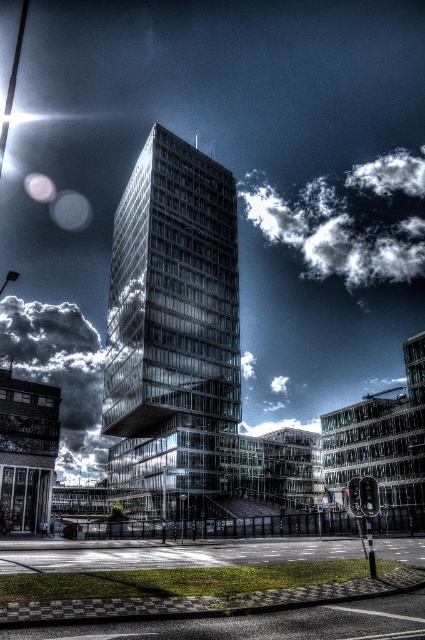
Which is below, white fluffy cloud at upper right or cloudy sky at upper left?

Positioned lower is cloudy sky at upper left.

Based on the photo, between white fluffy cloud at upper right and cloudy sky at upper left, which one appears on the right side from the viewer's perspective?

From the viewer's perspective, white fluffy cloud at upper right appears more on the right side.

Is point (405, 272) positioned after point (25, 342)?

Yes, point (405, 272) is behind point (25, 342).

Identify the location of white fluffy cloud at upper right. click(334, 234).

Measure the distance from transparent glass tower at center to cloudy sky at upper left.

transparent glass tower at center and cloudy sky at upper left are 53.00 meters apart.

Is transparent glass tower at center below cloudy sky at upper left?

No.

This screenshot has height=640, width=425. I want to click on transparent glass tower at center, so click(x=172, y=332).

Is transparent glass tower at center wider than white fluffy cloud at upper right?

No.

Does point (226, 344) lie in front of point (323, 212)?

Yes.

Locate an element on the screen. Image resolution: width=425 pixels, height=640 pixels. transparent glass tower at center is located at coordinates (172, 332).

Locate an element on the screen. The height and width of the screenshot is (640, 425). transparent glass tower at center is located at coordinates (172, 332).